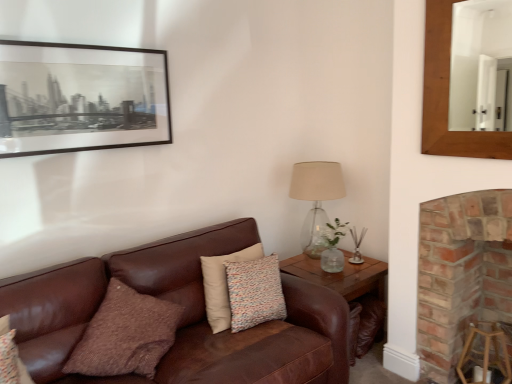
Question: Looking at the image, does wooden stool at lower right seem bigger or smaller compared to brown leather couch at center?

Choices:
 (A) small
 (B) big

Answer: (A)

Question: Do you think wooden stool at lower right is within brown leather couch at center, or outside of it?

Choices:
 (A) inside
 (B) outside

Answer: (B)

Question: Which object is the closest to the black matte picture frame at upper left?

Choices:
 (A) translucent glass table lamp at right
 (B) wooden mirror at upper right
 (C) wooden stool at lower right
 (D) brown leather couch at center
 (E) brown textured pillow at center

Answer: (D)

Question: Which object is positioned farthest from the black matte picture frame at upper left?

Choices:
 (A) brick fireplace at right
 (B) wooden mirror at upper right
 (C) wooden stool at lower right
 (D) wooden side table at lower right
 (E) translucent glass table lamp at right

Answer: (B)